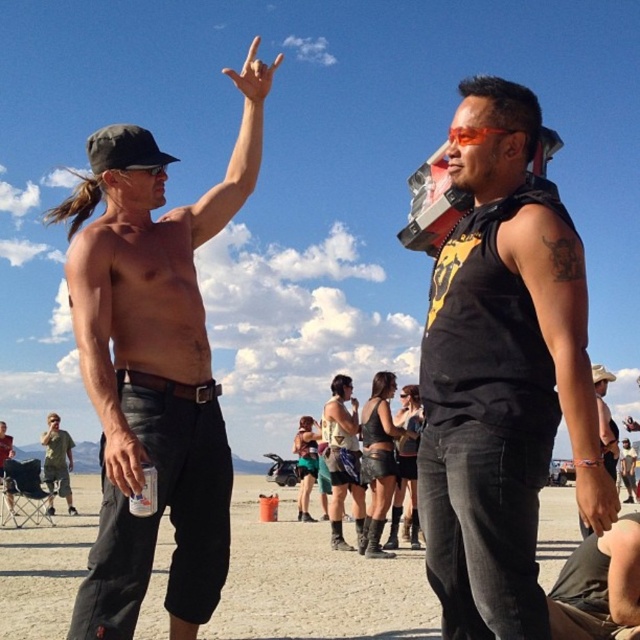
You are at an outdoor event and want to grab a drink quickly. You see the matte plastic cup at lower left and the brushed metal can at lower left. Which one is easier to reach?

The matte plastic cup at lower left is closer to the viewer than the brushed metal can at lower left, so it is easier to reach.

Looking at this image, you are standing at the camera position and want to take a photo of the point at coordinates (540, 472). The camera has a maximum focus range of 25 feet. Will the point be in focus?

The point at coordinates (540, 472) is 24.03 feet from the camera, which is within the maximum focus range of 25 feet. Therefore, the point will be in focus.